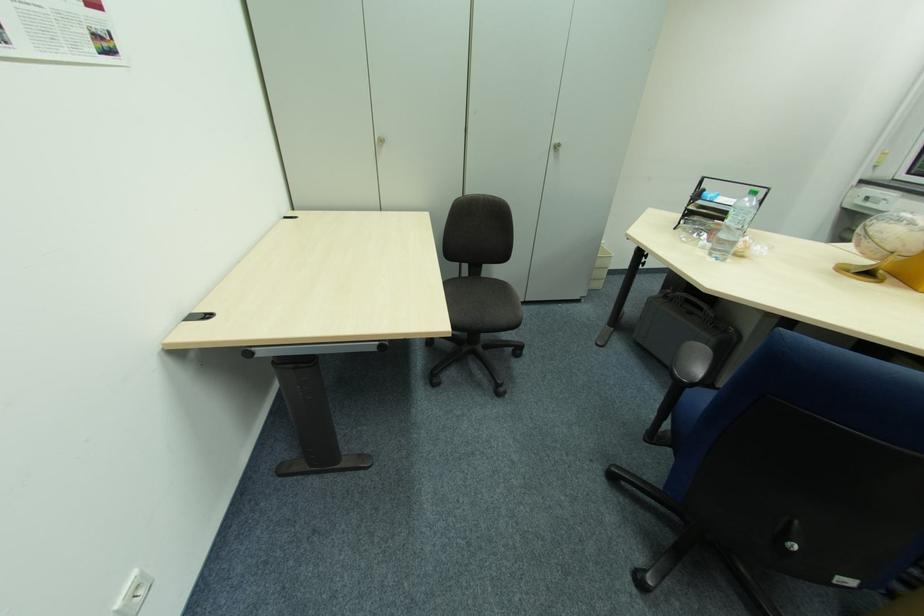
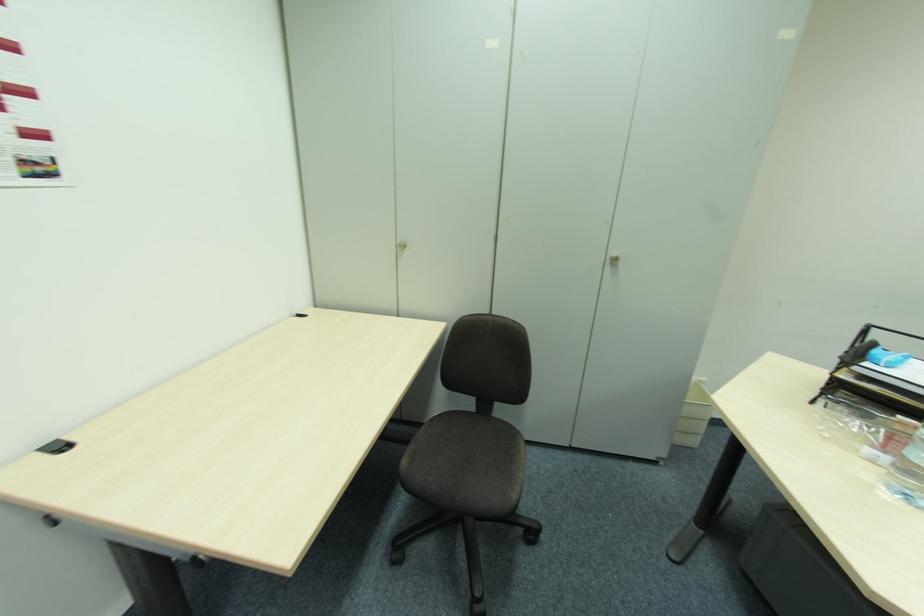
What movement of the cameraman would produce the second image?

The cameraman moved toward right, forward.